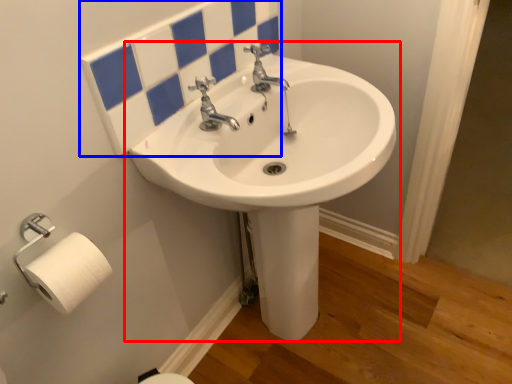
Question: Which object appears farthest to the camera in this image, sink (highlighted by a red box) or mirror (highlighted by a blue box)?

Choices:
 (A) sink
 (B) mirror

Answer: (B)